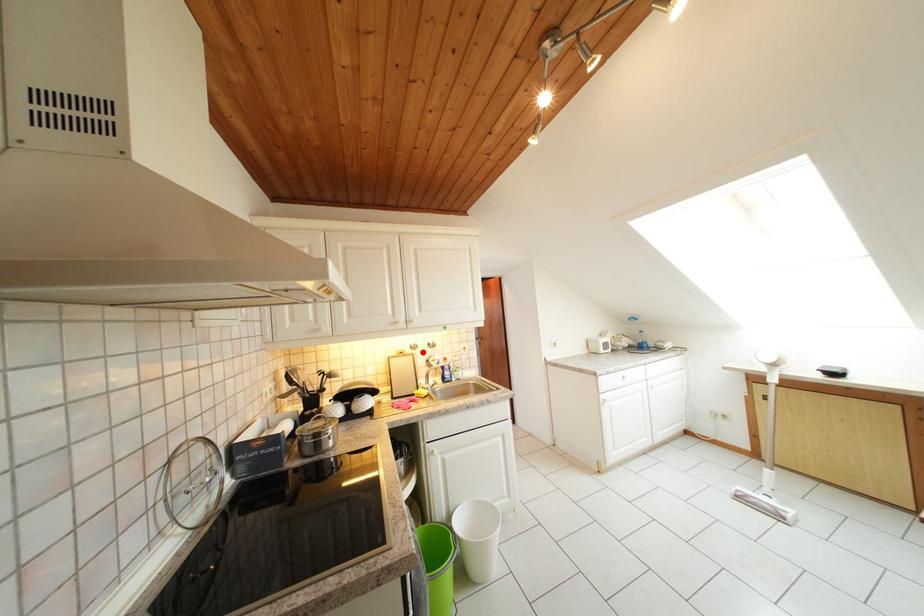
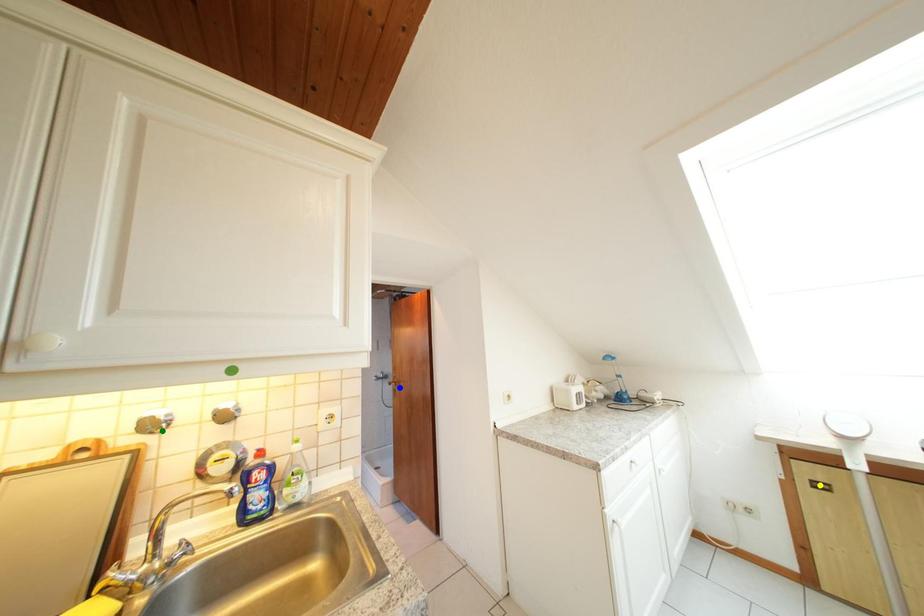
Question: I am providing you with two images of the same scene from different viewpoints. A red point is marked on the first image. You are given multiple points on the second image. Which mark in image 2 goes with the point in image 1?

Choices:
 (A) blue point
 (B) yellow point
 (C) green point

Answer: (C)